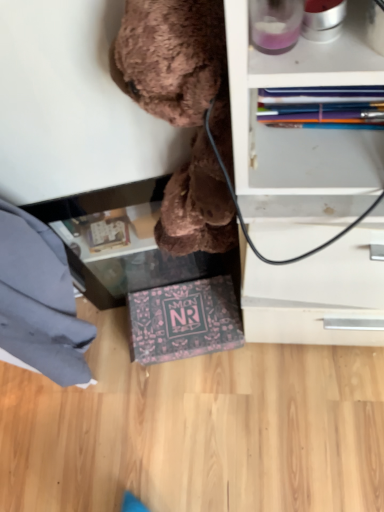
Identify the location of free area below dark blue fabric at lower left (from a real-world perspective). (111, 362).